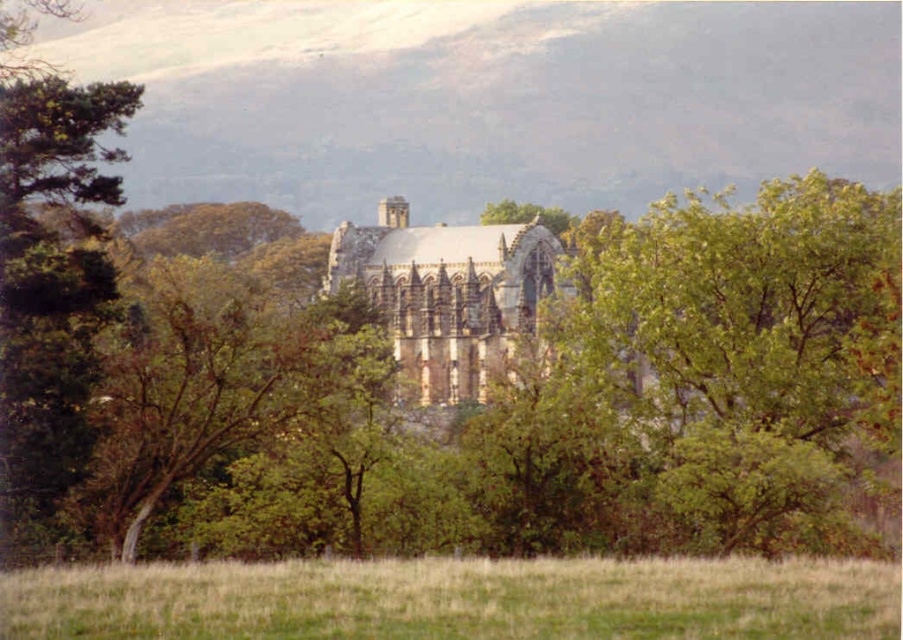
Question: Is green leafy tree at center positioned before green grass at lower center?

Choices:
 (A) yes
 (B) no

Answer: (B)

Question: Is green leafy tree at center smaller than green grass at lower center?

Choices:
 (A) no
 (B) yes

Answer: (A)

Question: Is green leafy tree at center bigger than green grass at lower center?

Choices:
 (A) yes
 (B) no

Answer: (A)